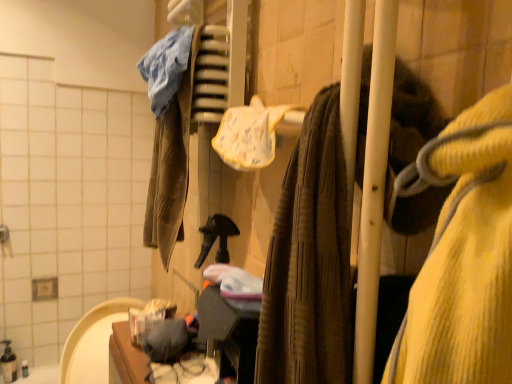
This screenshot has height=384, width=512. Describe the element at coordinates (457, 46) in the screenshot. I see `knitted wool sweater at center` at that location.

This screenshot has width=512, height=384. What are the coordinates of `knitted wool sweater at center` in the screenshot? It's located at (457, 46).

Where is `white textured cloth at center`? The image size is (512, 384). white textured cloth at center is located at coordinates (252, 133).

What do you see at coordinates (252, 133) in the screenshot?
I see `white textured cloth at center` at bounding box center [252, 133].

At what (x,y) coordinates should I click in order to perform the action: click on knitted wool sweater at center. Please return your answer as a coordinate pair (x, y). The height and width of the screenshot is (384, 512). Looking at the image, I should click on (457, 46).

Is knitted wool sweater at center to the left of white textured cloth at center from the viewer's perspective?

No, knitted wool sweater at center is not to the left of white textured cloth at center.

Which object is closer to the camera taking this photo, knitted wool sweater at center or white textured cloth at center?

knitted wool sweater at center is more forward.

Which is less distant, (159,287) or (258,162)?

Point (159,287) is positioned farther from the camera compared to point (258,162).

From the image's perspective, which one is positioned lower, knitted wool sweater at center or white textured cloth at center?

knitted wool sweater at center, from the image's perspective.

From a real-world perspective, is knitted wool sweater at center positioned over white textured cloth at center based on gravity?

No, from a real-world perspective, knitted wool sweater at center is not over white textured cloth at center

Considering the relative sizes of knitted wool sweater at center and white textured cloth at center in the image provided, is knitted wool sweater at center wider than white textured cloth at center?

Yes.

In terms of height, does knitted wool sweater at center look taller or shorter compared to white textured cloth at center?

knitted wool sweater at center is taller than white textured cloth at center.

Is knitted wool sweater at center bigger than white textured cloth at center?

Correct, knitted wool sweater at center is larger in size than white textured cloth at center.

Would you say knitted wool sweater at center is inside or outside white textured cloth at center?

knitted wool sweater at center lies outside white textured cloth at center.

Is knitted wool sweater at center touching white textured cloth at center?

No, knitted wool sweater at center is not making contact with white textured cloth at center.

Is knitted wool sweater at center aimed at white textured cloth at center?

No, knitted wool sweater at center does not turn towards white textured cloth at center.

How different are the orientations of knitted wool sweater at center and white textured cloth at center in degrees?

179 degrees.

Identify the location of bath towel on the left of knitted wool sweater at center. This screenshot has height=384, width=512. (252, 133).

In the image, is white textured cloth at center on the left side or the right side of knitted wool sweater at center?

Based on their positions, white textured cloth at center is located to the left of knitted wool sweater at center.

Which is behind, white textured cloth at center or knitted wool sweater at center?

Positioned behind is white textured cloth at center.

Considering the positions of points (223, 135) and (337, 69), is point (223, 135) farther from camera compared to point (337, 69)?

Yes.

From the image's perspective, is white textured cloth at center located beneath knitted wool sweater at center?

No, from the image's perspective, white textured cloth at center is not beneath knitted wool sweater at center.

From a real-world perspective, is white textured cloth at center physically above knitted wool sweater at center?

Yes, from a real-world perspective, white textured cloth at center is on top of knitted wool sweater at center.

Considering the sizes of white textured cloth at center and knitted wool sweater at center in the image, is white textured cloth at center wider or thinner than knitted wool sweater at center?

white textured cloth at center is thinner than knitted wool sweater at center.

Considering the sizes of objects white textured cloth at center and knitted wool sweater at center in the image provided, who is taller, white textured cloth at center or knitted wool sweater at center?

Standing taller between the two is knitted wool sweater at center.

Considering the relative sizes of white textured cloth at center and knitted wool sweater at center in the image provided, is white textured cloth at center smaller than knitted wool sweater at center?

Correct, white textured cloth at center occupies less space than knitted wool sweater at center.

Is white textured cloth at center inside the boundaries of knitted wool sweater at center, or outside?

white textured cloth at center is outside knitted wool sweater at center.

Would you consider white textured cloth at center to be distant from knitted wool sweater at center?

No, white textured cloth at center is not far from knitted wool sweater at center.

Is white textured cloth at center looking in the opposite direction of knitted wool sweater at center?

white textured cloth at center does not have its back to knitted wool sweater at center.

What's the angular difference between white textured cloth at center and knitted wool sweater at center's facing directions?

white textured cloth at center and knitted wool sweater at center are facing 179 degrees away from each other.

This screenshot has width=512, height=384. In the image, there is a knitted wool sweater at center. What are the coordinates of `bath towel above it (from the image's perspective)` in the screenshot? It's located at (252, 133).

At what (x,y) coordinates should I click in order to perform the action: click on bath towel located above the knitted wool sweater at center (from a real-world perspective). Please return your answer as a coordinate pair (x, y). Looking at the image, I should click on (252, 133).

Locate an element on the screen. Image resolution: width=512 pixels, height=384 pixels. closet below the white textured cloth at center (from the image's perspective) is located at coordinates (457, 46).